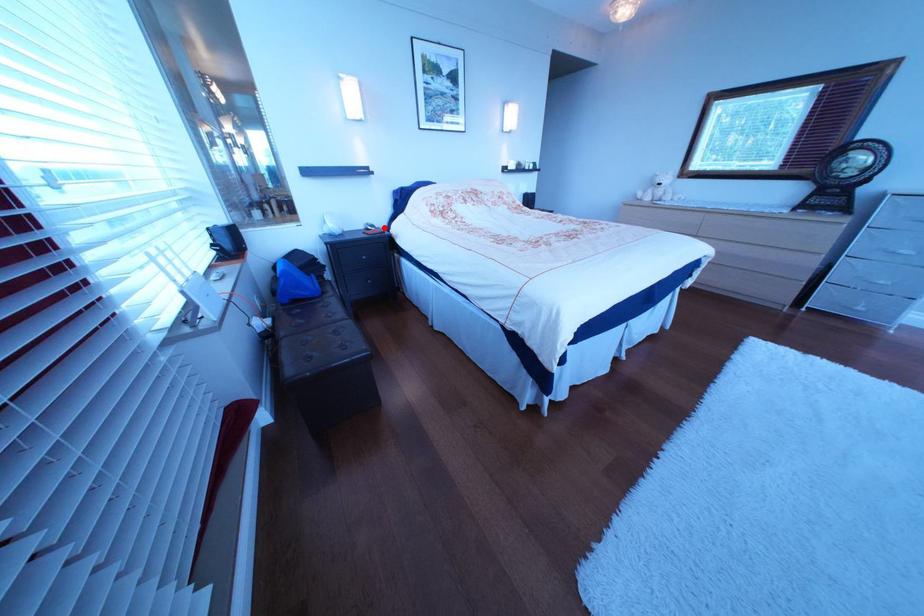
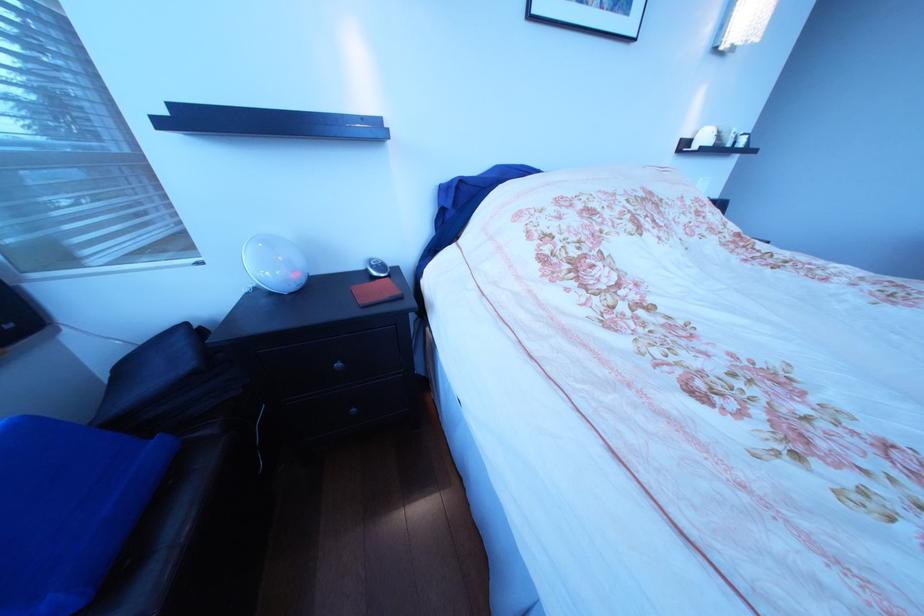
Question: I am providing you with two images of the same scene from different viewpoints. Image1 has a red point marked. In image2, the corresponding 3D location appears at what relative position? Reply with the corresponding letter.

Choices:
 (A) Closer
 (B) Farther

Answer: (B)